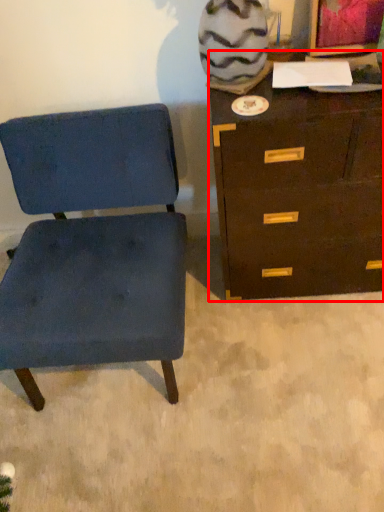
Question: From the image's perspective, what is the correct spatial positioning of chest of drawers (annotated by the red box) in reference to chair?

Choices:
 (A) above
 (B) below

Answer: (A)